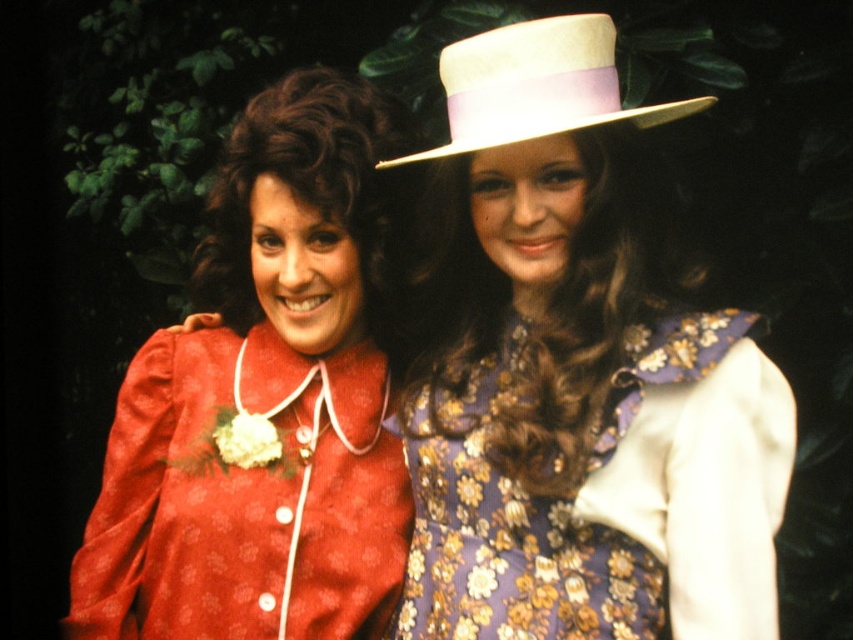
Question: Is matte red jacket at center in front of matte red dress at left?

Choices:
 (A) no
 (B) yes

Answer: (B)

Question: Which point appears closest to the camera in this image?

Choices:
 (A) (308, 616)
 (B) (543, 74)
 (C) (463, 40)

Answer: (B)

Question: Which point is closer to the camera?

Choices:
 (A) matte red dress at left
 (B) white felt hat at upper center
 (C) floral-patterned fabric dress at center

Answer: (B)

Question: Is matte red jacket at center smaller than white felt hat at upper center?

Choices:
 (A) no
 (B) yes

Answer: (A)

Question: Which object appears closest to the camera in this image?

Choices:
 (A) matte red dress at left
 (B) white felt hat at upper center
 (C) floral-patterned fabric dress at center

Answer: (B)

Question: Can you confirm if matte red jacket at center is smaller than floral-patterned fabric dress at center?

Choices:
 (A) yes
 (B) no

Answer: (B)